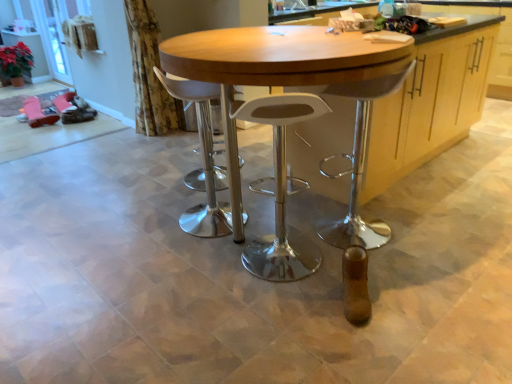
I want to click on vacant space in between wooden table at center and white plastic stool at center, the 1th stool from the right, so click(x=219, y=270).